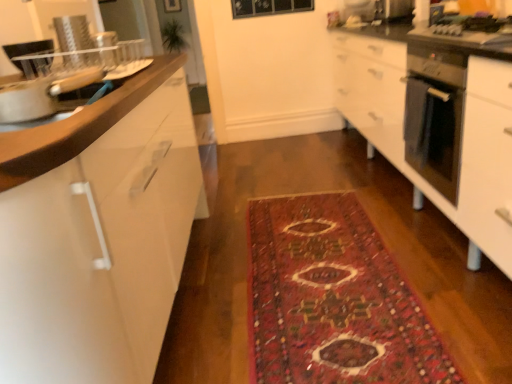
This screenshot has width=512, height=384. What are the coordinates of `free spot above carpeted rug at center (from a real-world perspective)` in the screenshot? It's located at (328, 272).